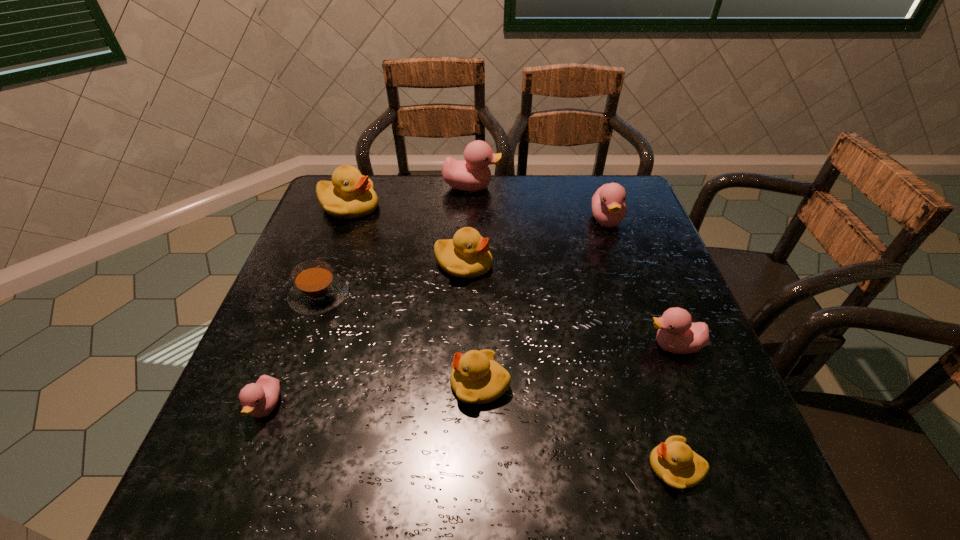
Find the location of `free region located on the front-facing side of the second smallest pink duckling`. free region located on the front-facing side of the second smallest pink duckling is located at coordinates (602, 346).

The image size is (960, 540). I want to click on free space located 0.300m at the face of the second nearest yellow duckling, so click(297, 384).

You are a GUI agent. You are given a task and a screenshot of the screen. Output one action in this format:
    pyautogui.click(x=<x>, y=<y>)
    Task: Click on the vacant point located 0.230m at the face of the second nearest yellow duckling
    
    Given the screenshot: What is the action you would take?
    pyautogui.click(x=332, y=384)

Identify the location of free space located 0.390m at the face of the second nearest yellow duckling. (251, 384).

This screenshot has width=960, height=540. I want to click on vacant position located on the front-facing side of the nearest pink duckling, so click(243, 468).

I want to click on vacant space located 0.070m on the back of the brown cappuccino, so click(x=334, y=256).

I want to click on blank space located 0.270m at the face of the nearest yellow duckling, so click(x=490, y=467).

At what (x,y) coordinates should I click in order to perform the action: click on vacant area located 0.240m at the face of the nearest yellow duckling. Please return your answer as a coordinate pair (x, y). Looking at the image, I should click on (507, 467).

Find the location of a particular element. free space located 0.050m at the face of the nearest yellow duckling is located at coordinates (620, 467).

Locate an element on the screen. Image resolution: width=960 pixels, height=540 pixels. object that is at the near edge is located at coordinates (674, 462).